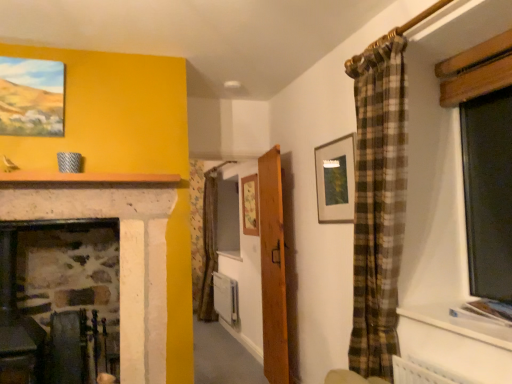
Question: Considering the relative sizes of wooden picture frame at center, which is the second picture frame from right to left, and matte wooden picture frame at upper left, which is the third picture frame in right-to-left order, in the image provided, is wooden picture frame at center, which is the second picture frame from right to left, wider than matte wooden picture frame at upper left, which is the third picture frame in right-to-left order,?

Choices:
 (A) yes
 (B) no

Answer: (B)

Question: Is the depth of wooden picture frame at center, which is the second picture frame from right to left, greater than that of matte wooden picture frame at upper left, which is the third picture frame in right-to-left order?

Choices:
 (A) no
 (B) yes

Answer: (B)

Question: Is wooden picture frame at center, which is the third picture frame in front-to-back order, facing towards matte wooden picture frame at upper left, the third picture frame when ordered from back to front?

Choices:
 (A) no
 (B) yes

Answer: (A)

Question: Considering the relative sizes of wooden picture frame at center, which is the third picture frame in front-to-back order, and matte wooden picture frame at upper left, the 1th picture frame when ordered from front to back, in the image provided, is wooden picture frame at center, which is the third picture frame in front-to-back order, thinner than matte wooden picture frame at upper left, the 1th picture frame when ordered from front to back,?

Choices:
 (A) yes
 (B) no

Answer: (A)

Question: Would you say wooden picture frame at center, which is the third picture frame in front-to-back order, is outside matte wooden picture frame at upper left, marked as the 1th picture frame in a left-to-right arrangement?

Choices:
 (A) no
 (B) yes

Answer: (B)

Question: Considering the relative positions of wooden picture frame at center, the 1th picture frame viewed from the back, and matte wooden picture frame at upper left, which is the third picture frame in right-to-left order, in the image provided, is wooden picture frame at center, the 1th picture frame viewed from the back, in front of matte wooden picture frame at upper left, which is the third picture frame in right-to-left order,?

Choices:
 (A) no
 (B) yes

Answer: (A)

Question: From the image's perspective, is white plastic radiator at center over matte wooden picture frame at upper left, the third picture frame when ordered from back to front?

Choices:
 (A) no
 (B) yes

Answer: (A)

Question: Considering the relative sizes of white plastic radiator at center and matte wooden picture frame at upper left, the 1th picture frame when ordered from front to back, in the image provided, is white plastic radiator at center smaller than matte wooden picture frame at upper left, the 1th picture frame when ordered from front to back,?

Choices:
 (A) yes
 (B) no

Answer: (B)

Question: Is white plastic radiator at center touching matte wooden picture frame at upper left, the 1th picture frame when ordered from front to back?

Choices:
 (A) yes
 (B) no

Answer: (B)

Question: Considering the relative positions of white plastic radiator at center and matte wooden picture frame at upper left, which is the third picture frame in right-to-left order, in the image provided, is white plastic radiator at center to the left of matte wooden picture frame at upper left, which is the third picture frame in right-to-left order, from the viewer's perspective?

Choices:
 (A) yes
 (B) no

Answer: (B)

Question: Is white plastic radiator at center not within matte wooden picture frame at upper left, which is the third picture frame in right-to-left order?

Choices:
 (A) yes
 (B) no

Answer: (A)

Question: Is white plastic radiator at center positioned before matte wooden picture frame at upper left, marked as the 1th picture frame in a left-to-right arrangement?

Choices:
 (A) yes
 (B) no

Answer: (B)

Question: From a real-world perspective, is matte wooden picture frame at upper left, the third picture frame when ordered from back to front, under wooden door at center?

Choices:
 (A) yes
 (B) no

Answer: (B)